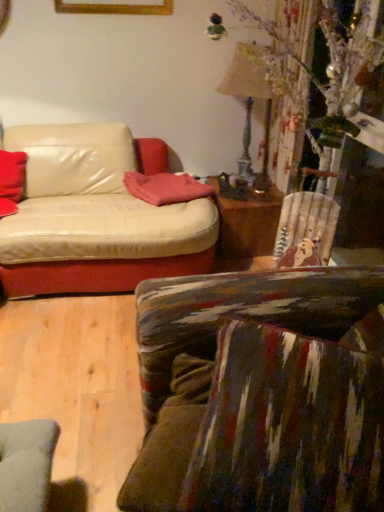
Question: Considering the relative sizes of matte red cushion at left, arranged as the second pillow when viewed from the right, and wooden table at center in the image provided, is matte red cushion at left, arranged as the second pillow when viewed from the right, thinner than wooden table at center?

Choices:
 (A) yes
 (B) no

Answer: (A)

Question: Is matte red cushion at left, the first pillow viewed from the left, aimed at wooden table at center?

Choices:
 (A) yes
 (B) no

Answer: (B)

Question: Considering the relative sizes of matte red cushion at left, arranged as the second pillow when viewed from the right, and wooden table at center in the image provided, is matte red cushion at left, arranged as the second pillow when viewed from the right, taller than wooden table at center?

Choices:
 (A) yes
 (B) no

Answer: (A)

Question: Is wooden table at center located within matte red cushion at left, arranged as the second pillow when viewed from the right?

Choices:
 (A) no
 (B) yes

Answer: (A)

Question: Does matte red cushion at left, the first pillow viewed from the left, come in front of wooden table at center?

Choices:
 (A) no
 (B) yes

Answer: (B)

Question: Is point (246, 238) positioned closer to the camera than point (132, 178)?

Choices:
 (A) closer
 (B) farther

Answer: (B)

Question: From the image's perspective, relative to pink fabric pillow at center, positioned as the 2th pillow in left-to-right order, is wooden table at center above or below?

Choices:
 (A) above
 (B) below

Answer: (B)

Question: Looking at their shapes, would you say wooden table at center is wider or thinner than pink fabric pillow at center, which is the 1th pillow from right to left?

Choices:
 (A) wide
 (B) thin

Answer: (A)

Question: Choose the correct answer: Is wooden table at center inside pink fabric pillow at center, positioned as the 2th pillow in left-to-right order, or outside it?

Choices:
 (A) inside
 (B) outside

Answer: (B)

Question: From the image's perspective, is pink fabric pillow at center, positioned as the 2th pillow in left-to-right order, above or below wooden table at center?

Choices:
 (A) above
 (B) below

Answer: (A)

Question: Does point (183, 196) appear closer or farther from the camera than point (231, 214)?

Choices:
 (A) farther
 (B) closer

Answer: (B)

Question: Is pink fabric pillow at center, positioned as the 2th pillow in left-to-right order, inside the boundaries of wooden table at center, or outside?

Choices:
 (A) outside
 (B) inside

Answer: (A)

Question: Is pink fabric pillow at center, which is the 1th pillow from right to left, in front of or behind wooden table at center in the image?

Choices:
 (A) front
 (B) behind

Answer: (A)

Question: Would you say textured multicolored fabric couch at lower right is to the left or to the right of pink fabric pillow at center, which is the 1th pillow from right to left, in the picture?

Choices:
 (A) right
 (B) left

Answer: (A)

Question: Considering their positions, is textured multicolored fabric couch at lower right located in front of or behind pink fabric pillow at center, positioned as the 2th pillow in left-to-right order?

Choices:
 (A) front
 (B) behind

Answer: (A)